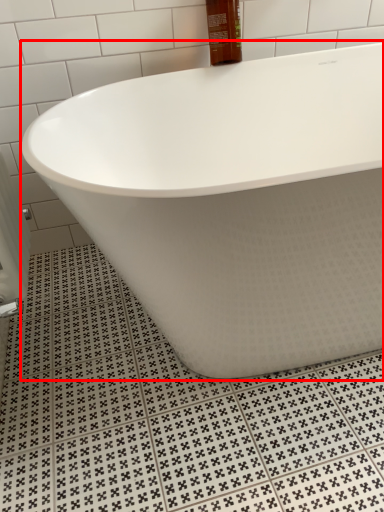
Question: Where is bathtub (annotated by the red box) located in relation to mouthwash in the image?

Choices:
 (A) right
 (B) left

Answer: (A)